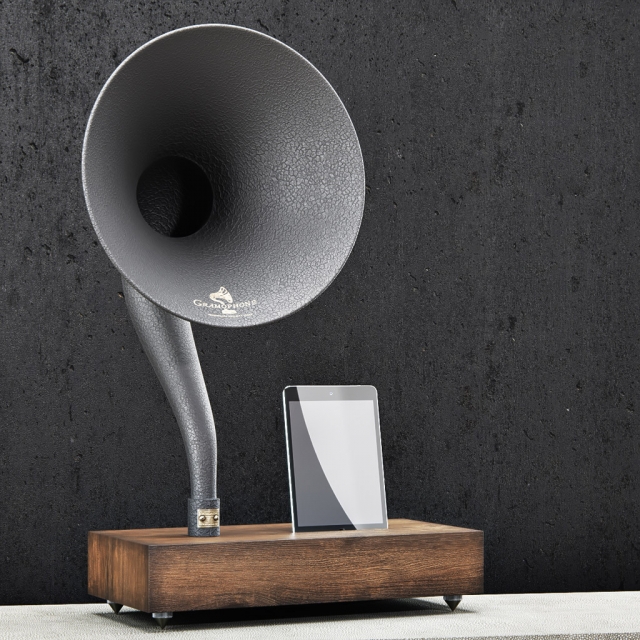
This screenshot has height=640, width=640. In order to click on large speaker in this screenshot , I will do `click(301, 164)`.